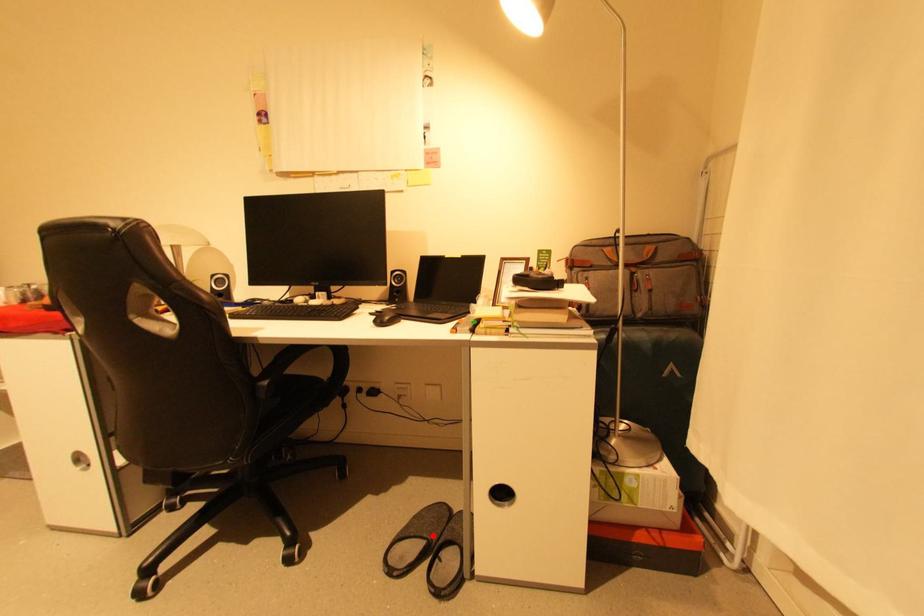
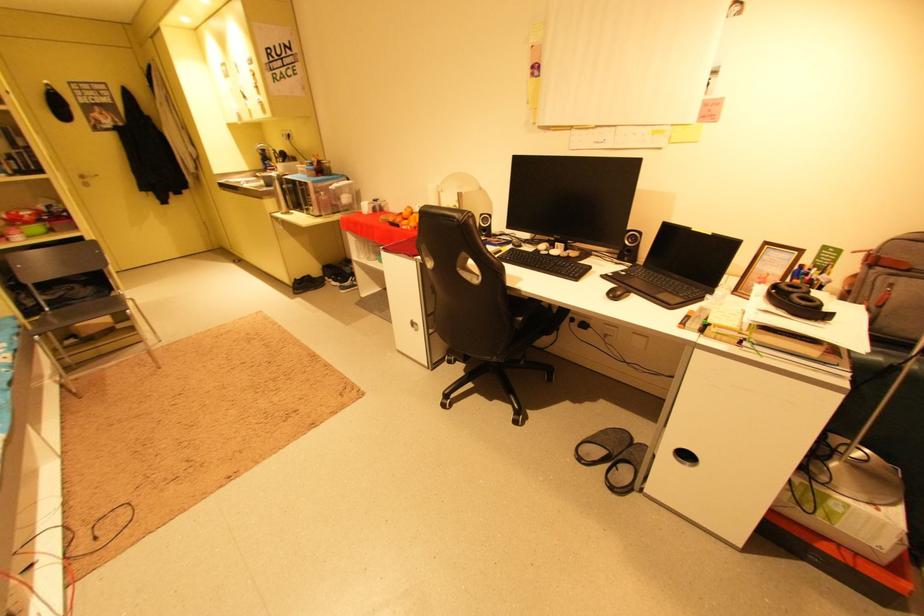
Question: A red point is marked in image1. In image2, is the corresponding 3D point closer to the camera or farther? Reply with the corresponding letter.

Choices:
 (A) The corresponding 3D point is closer.
 (B) The corresponding 3D point is farther.

Answer: (A)